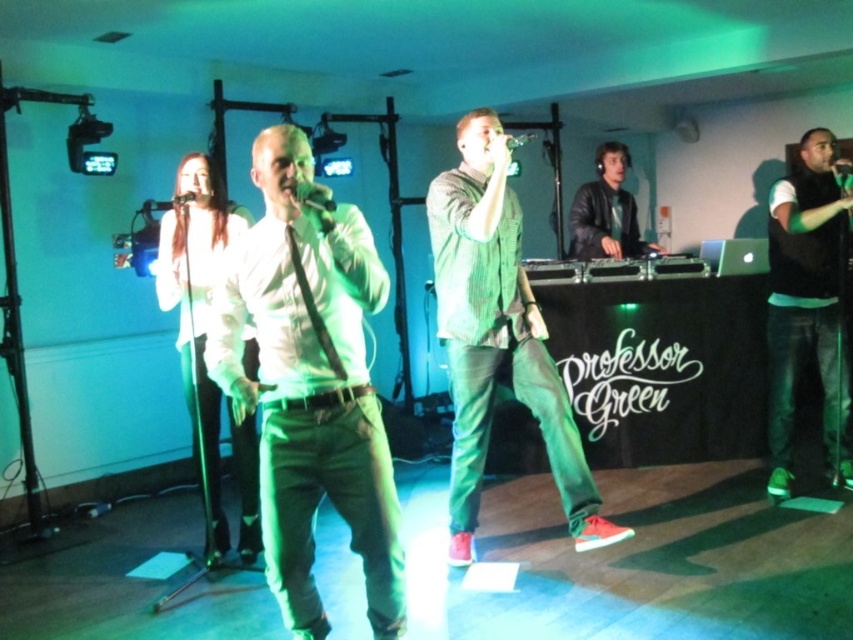
Question: Is white matte shirt at center thinner than black leather jacket at center?

Choices:
 (A) no
 (B) yes

Answer: (B)

Question: Which point is closer to the camera?

Choices:
 (A) white matte shirt at left
 (B) black leather jacket at center
 (C) white matte shirt at center

Answer: (C)

Question: Can you confirm if green textured shirt at center is bigger than metallic silver microphone at upper center?

Choices:
 (A) yes
 (B) no

Answer: (A)

Question: Which object is farther from the camera taking this photo?

Choices:
 (A) black leather jacket at center
 (B) white matte shirt at left

Answer: (A)

Question: Which of the following is the closest to the observer?

Choices:
 (A) (192, 196)
 (B) (602, 198)

Answer: (A)

Question: Does white matte shirt at left have a greater width compared to metallic silver microphone at upper center?

Choices:
 (A) no
 (B) yes

Answer: (B)